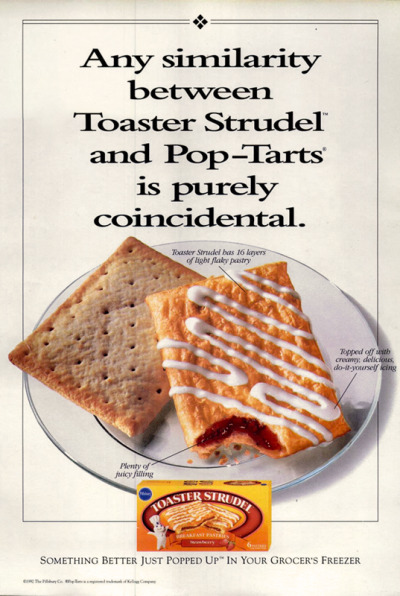
What are the coordinates of `toaster strudel box` in the screenshot? It's located at (198, 515).